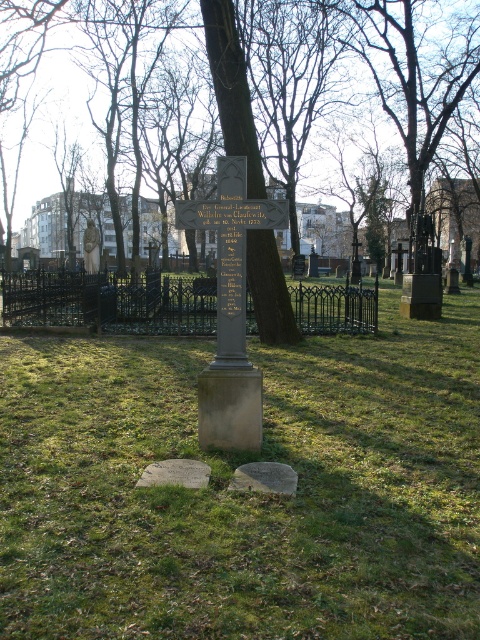
Can you confirm if green leafy tree at center is positioned to the right of bronze statue at left?

Indeed, green leafy tree at center is positioned on the right side of bronze statue at left.

Which is behind, point (443, 61) or point (95, 248)?

Point (443, 61)

Is point (275, 269) positioned in front of point (96, 248)?

Yes, it is.

Find the location of a particular element. green leafy tree at center is located at coordinates (418, 54).

Which of these two, green grass at center or bronze statue at left, stands taller?

Standing taller between the two is bronze statue at left.

Is green grass at center wider than bronze statue at left?

Result: Yes.

Identify the location of green grass at center. (244, 492).

Which is below, green grass at center or green leafy tree at center?

green grass at center is lower down.

Can you confirm if green grass at center is bigger than green leafy tree at center?

Incorrect, green grass at center is not larger than green leafy tree at center.

You are a GUI agent. You are given a task and a screenshot of the screen. Output one action in this format:
    pyautogui.click(x=<x>, y=<y>)
    Task: Click on the green grass at center
    The image size is (480, 640).
    Given the screenshot: What is the action you would take?
    pyautogui.click(x=244, y=492)

Find the location of a particular element. green grass at center is located at coordinates 244,492.